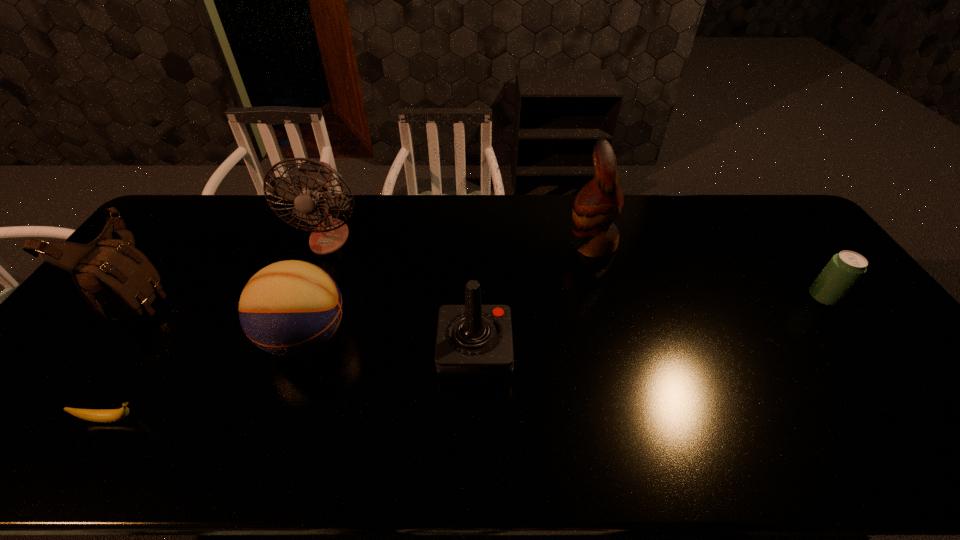
Locate an element on the screen. vacant space located on the face of the parrot is located at coordinates (444, 245).

The image size is (960, 540). Identify the location of vacant space located 0.370m on the face of the parrot. (454, 245).

Identify the location of free space located in front of the fan to direct airflow. (303, 306).

Where is `free space located 0.220m on the front-facing side of the shoulder bag`? The height and width of the screenshot is (540, 960). free space located 0.220m on the front-facing side of the shoulder bag is located at coordinates (245, 294).

I want to click on blank space located on the front-facing side of the third object from right to left, so click(x=603, y=352).

Identify the location of vacant point located 0.220m on the patterned surface of the basketball. This screenshot has width=960, height=540. (433, 338).

The height and width of the screenshot is (540, 960). I want to click on vacant space situated on the left of the second shortest object, so click(761, 297).

Locate an element on the screen. This screenshot has height=540, width=960. free region located at the stem of the nearest object is located at coordinates (298, 419).

The width and height of the screenshot is (960, 540). I want to click on parrot that is at the far edge, so click(598, 204).

Locate an element on the screen. This screenshot has width=960, height=540. fan situated at the far edge is located at coordinates (315, 177).